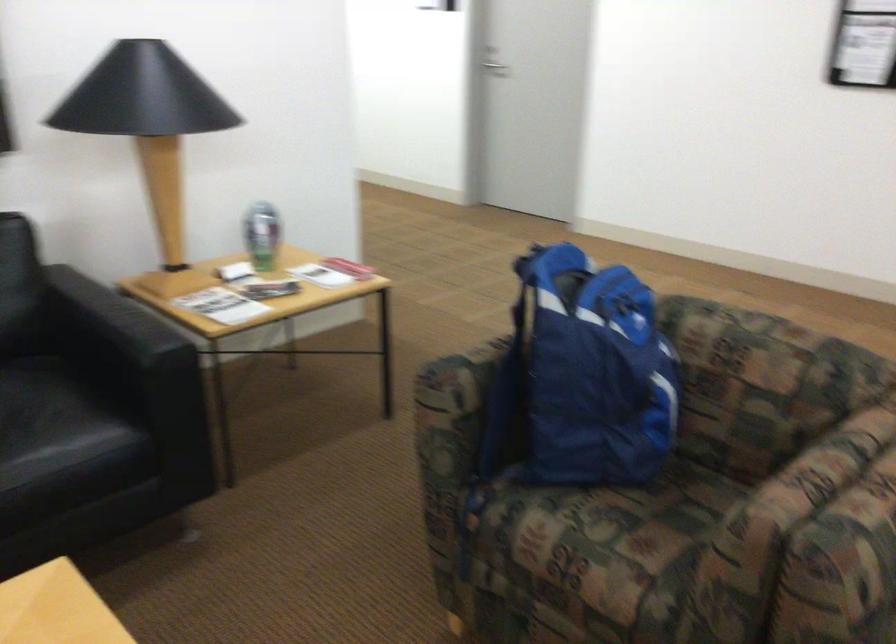
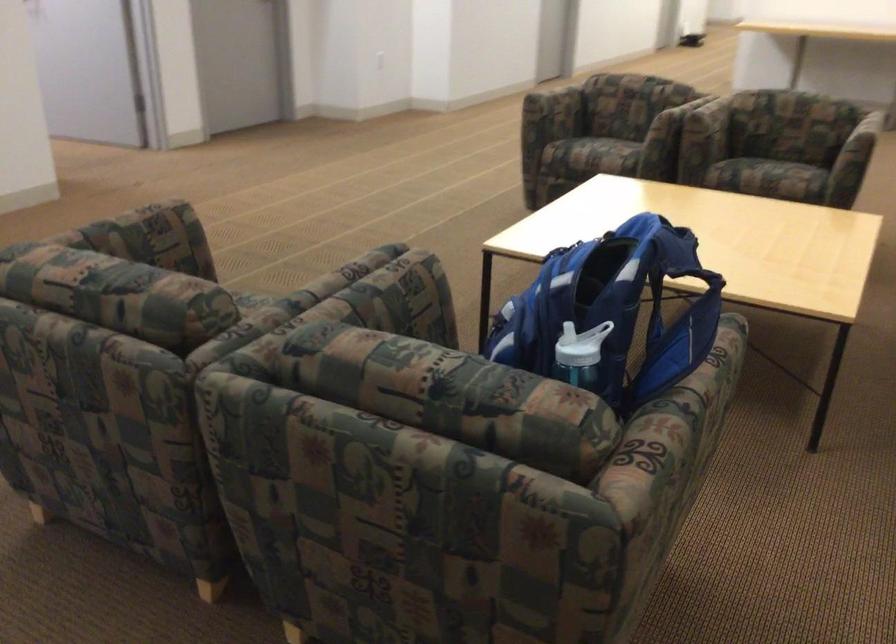
The point at (616, 307) is marked in the first image. Where is the corresponding point in the second image?

(574, 348)